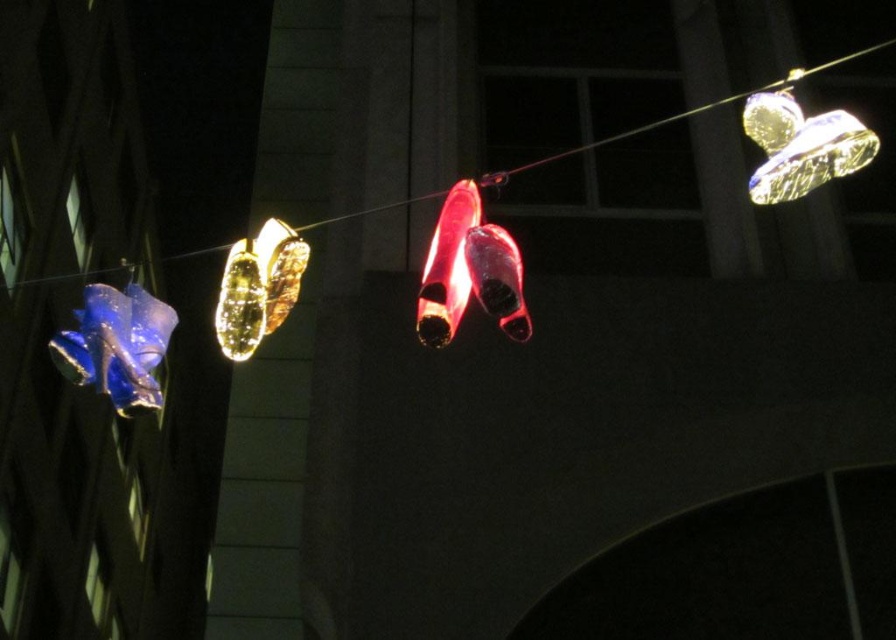
You are an art installer setting up a display of glossy plastic shoes. You have two groups of shoes hanging from a wire in the center of the image. The first group is a single glossy plastic shoe at center, and the second group is multiple glossy plastic shoes at center. According to the scene description, how far apart are these two groups of shoes?

The glossy plastic shoe at center is 5.87 meters away from the glossy plastic shoes at center, so the two groups are 5.87 meters apart.

You are standing in front of the nighttime display of suspended high heels. There are two points marked on the wire holding the shoes. The first point is at coordinates point (225, 291) and the second is at point (481, 182). Which point is nearer to you?

Point (225, 291) is closer to the viewer than point (481, 182).

You are standing in front of the nighttime display of suspended high heels. There is a glossy plastic shoe at center marked by point [448,266]. If you want to find this shoe in the dark, which coordinate should you look at?

The glossy plastic shoe at center is located at coordinate point [448,266].